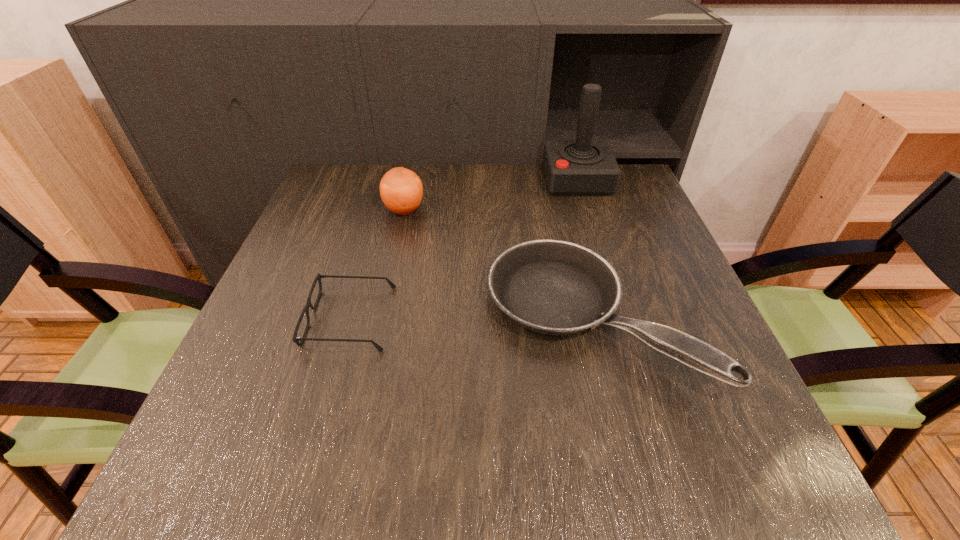
Locate an element on the screen. joystick is located at coordinates (583, 167).

Where is `the farthest object`? Image resolution: width=960 pixels, height=540 pixels. the farthest object is located at coordinates (583, 167).

Identify the location of the second farthest object. This screenshot has height=540, width=960. (401, 190).

Image resolution: width=960 pixels, height=540 pixels. I want to click on orange, so click(401, 190).

The width and height of the screenshot is (960, 540). In order to click on frying pan in this screenshot , I will do `click(554, 287)`.

Where is `spectacles`? spectacles is located at coordinates (296, 339).

Where is `free space located 0.140m on the base of the joystick`? This screenshot has width=960, height=540. free space located 0.140m on the base of the joystick is located at coordinates (495, 180).

I want to click on vacant space positioned on the base of the joystick, so click(x=464, y=180).

You are a GUI agent. You are given a task and a screenshot of the screen. Output one action in this format:
    pyautogui.click(x=<x>, y=<y>)
    Task: Click on the vacant space located on the base of the joystick
    The image size is (960, 540).
    Given the screenshot: What is the action you would take?
    pyautogui.click(x=445, y=180)

Where is `vacant area situated 0.120m on the left of the orange`? The image size is (960, 540). vacant area situated 0.120m on the left of the orange is located at coordinates (337, 210).